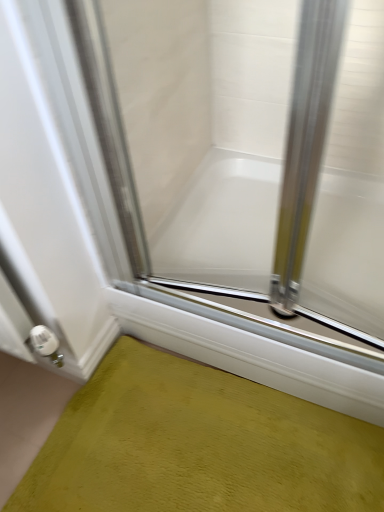
What do you see at coordinates (246, 160) in the screenshot? I see `clear glass door at center` at bounding box center [246, 160].

This screenshot has width=384, height=512. I want to click on green textured bath mat at lower left, so click(x=198, y=445).

You are a GUI agent. You are given a task and a screenshot of the screen. Output one action in this format:
    pyautogui.click(x=<x>, y=<y>)
    Task: Click on the white glossy bathtub at center
    
    Given the screenshot: What is the action you would take?
    pyautogui.click(x=222, y=224)

Does white glossy bathtub at center have a lesser height compared to clear glass door at center?

Indeed, white glossy bathtub at center has a lesser height compared to clear glass door at center.

Is point (367, 182) closer to camera compared to point (179, 63)?

No, it is behind (179, 63).

Consider the image. Considering their positions, is white glossy bathtub at center located in front of or behind clear glass door at center?

In the image, white glossy bathtub at center appears behind clear glass door at center.

Which point is more distant from viewer, (86, 4) or (371, 443)?

The point (371, 443) is farther from the camera.

From the picture: Considering the sizes of clear glass door at center and green textured bath mat at lower left in the image, is clear glass door at center bigger or smaller than green textured bath mat at lower left?

In the image, clear glass door at center appears to be larger than green textured bath mat at lower left.

Would you consider clear glass door at center to be distant from green textured bath mat at lower left?

clear glass door at center is near green textured bath mat at lower left, not far away.

Where is `bath mat located underneath the clear glass door at center (from a real-world perspective)`? bath mat located underneath the clear glass door at center (from a real-world perspective) is located at coordinates (198, 445).

Is green textured bath mat at lower left oriented away from clear glass door at center?

No, green textured bath mat at lower left's orientation is not away from clear glass door at center.

Is green textured bath mat at lower left outside of clear glass door at center?

Yes, green textured bath mat at lower left is located beyond the bounds of clear glass door at center.

How far apart are white glossy bathtub at center and green textured bath mat at lower left?

white glossy bathtub at center and green textured bath mat at lower left are 17.54 inches apart.

In terms of size, does white glossy bathtub at center appear bigger or smaller than green textured bath mat at lower left?

In the image, white glossy bathtub at center appears to be larger than green textured bath mat at lower left.

In the scene shown: Can you confirm if white glossy bathtub at center is thinner than green textured bath mat at lower left?

No.

Is white glossy bathtub at center to the left of green textured bath mat at lower left from the viewer's perspective?

In fact, white glossy bathtub at center is to the right of green textured bath mat at lower left.

Can you confirm if clear glass door at center is wider than white glossy bathtub at center?

No, clear glass door at center is not wider than white glossy bathtub at center.

Is clear glass door at center touching white glossy bathtub at center?

clear glass door at center is not next to white glossy bathtub at center, and they're not touching.

From their relative heights in the image, would you say clear glass door at center is taller or shorter than white glossy bathtub at center?

In the image, clear glass door at center appears to be taller than white glossy bathtub at center.

From the image's perspective, does clear glass door at center appear lower than white glossy bathtub at center?

No, from the image's perspective, clear glass door at center is not below white glossy bathtub at center.

Is green textured bath mat at lower left next to white glossy bathtub at center?

There is a gap between green textured bath mat at lower left and white glossy bathtub at center.

Is white glossy bathtub at center completely or partially inside green textured bath mat at lower left?

Actually, white glossy bathtub at center is outside green textured bath mat at lower left.

Is green textured bath mat at lower left facing away from white glossy bathtub at center?

That's right, green textured bath mat at lower left is facing away from white glossy bathtub at center.

From the image's perspective, is green textured bath mat at lower left on top of white glossy bathtub at center?

No, from the image's perspective, green textured bath mat at lower left is not above white glossy bathtub at center.

At what (x,y) coordinates should I click in order to perform the action: click on glass door in front of the white glossy bathtub at center. Please return your answer as a coordinate pair (x, y). The image size is (384, 512). Looking at the image, I should click on (246, 160).

At what (x,y) coordinates should I click in order to perform the action: click on bath mat that is under the clear glass door at center (from a real-world perspective). Please return your answer as a coordinate pair (x, y). The width and height of the screenshot is (384, 512). Looking at the image, I should click on (198, 445).

Considering their positions, is clear glass door at center positioned closer to green textured bath mat at lower left than white glossy bathtub at center?

white glossy bathtub at center is closer to green textured bath mat at lower left.

Considering their positions, is green textured bath mat at lower left positioned further to white glossy bathtub at center than clear glass door at center?

Based on the image, green textured bath mat at lower left appears to be further to white glossy bathtub at center.

From the image, which object appears to be farther from white glossy bathtub at center, clear glass door at center or green textured bath mat at lower left?

green textured bath mat at lower left is positioned further to the anchor white glossy bathtub at center.

When comparing their distances from clear glass door at center, does green textured bath mat at lower left or white glossy bathtub at center seem closer?

white glossy bathtub at center lies closer to clear glass door at center than the other object.

Looking at the image, which one is located closer to clear glass door at center, white glossy bathtub at center or green textured bath mat at lower left?

white glossy bathtub at center is positioned closer to the anchor clear glass door at center.

Consider the image. Based on their spatial positions, is white glossy bathtub at center or clear glass door at center further from green textured bath mat at lower left?

clear glass door at center is positioned further to the anchor green textured bath mat at lower left.

At what (x,y) coordinates should I click in order to perform the action: click on bathtub between clear glass door at center and green textured bath mat at lower left from top to bottom. Please return your answer as a coordinate pair (x, y). The image size is (384, 512). Looking at the image, I should click on (222, 224).